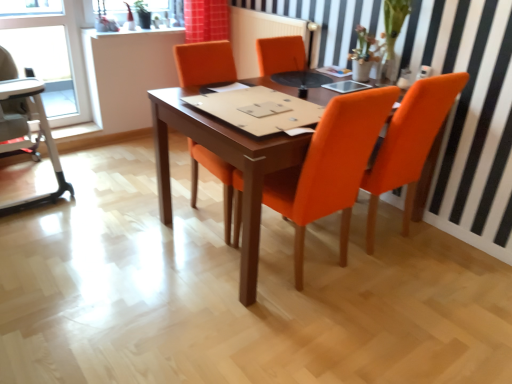
Find the location of a particular element. wooden table at center is located at coordinates (228, 161).

What do you see at coordinates (237, 219) in the screenshot?
I see `orange fabric chair at right, which is the 2th chair in left-to-right order` at bounding box center [237, 219].

At what (x,y) coordinates should I click in order to perform the action: click on beige fabric high chair at left. Please return your answer as a coordinate pair (x, y). The height and width of the screenshot is (384, 512). Looking at the image, I should click on (25, 126).

This screenshot has height=384, width=512. Identify the location of wooden table at center. (228, 161).

From the image's perspective, is orange fabric chair at right, the 1th chair from the right, over orange fabric chair at center, the second chair from the right?

Incorrect, from the image's perspective, orange fabric chair at right, the 1th chair from the right, is lower than orange fabric chair at center, the second chair from the right.

Which point is more forward, (439, 96) or (209, 44)?

The point (439, 96) is closer to the camera.

Considering the relative sizes of orange fabric chair at right, which is the 2th chair in left-to-right order, and orange fabric chair at center, the second chair from the right, in the image provided, is orange fabric chair at right, which is the 2th chair in left-to-right order, bigger than orange fabric chair at center, the second chair from the right,?

No, orange fabric chair at right, which is the 2th chair in left-to-right order, is not bigger than orange fabric chair at center, the second chair from the right.

From the image's perspective, is beige fabric high chair at left located above or below orange fabric chair at center, the second chair from the right?

beige fabric high chair at left is above orange fabric chair at center, the second chair from the right.

In terms of size, does beige fabric high chair at left appear bigger or smaller than orange fabric chair at center, the second chair from the right?

Considering their sizes, beige fabric high chair at left takes up more space than orange fabric chair at center, the second chair from the right.

From a real-world perspective, is beige fabric high chair at left located beneath orange fabric chair at center, positioned as the first chair in left-to-right order?

Indeed, from a real-world perspective, beige fabric high chair at left is positioned beneath orange fabric chair at center, positioned as the first chair in left-to-right order.

Does point (16, 88) appear closer or farther from the camera than point (226, 73)?

Point (16, 88) appears to be closer to the viewer than point (226, 73).

Between transparent glass window at upper left and wooden table at center, which one has smaller size?

With smaller size is transparent glass window at upper left.

Is transparent glass window at upper left looking in the opposite direction of wooden table at center?

No.

Can you see transparent glass window at upper left touching wooden table at center?

They are not placed beside each other.

Based on the photo, would you consider beige fabric high chair at left to be distant from wooden table at center?

beige fabric high chair at left is positioned a significant distance from wooden table at center.

From the image's perspective, who appears lower, beige fabric high chair at left or wooden table at center?

wooden table at center appears lower in the image.

From a real-world perspective, which object rests below the other?

In real-world perspective, wooden table at center is lower.

From a real-world perspective, which is physically below, orange fabric chair at center, the second chair from the right, or orange fabric chair at right, which is the 2th chair in left-to-right order?

In real-world perspective, orange fabric chair at right, which is the 2th chair in left-to-right order, is lower.

From the picture: Which is more to the right, orange fabric chair at center, the second chair from the right, or orange fabric chair at right, the 1th chair from the right?

orange fabric chair at right, the 1th chair from the right.

In the scene shown: Is the surface of orange fabric chair at center, the second chair from the right, in direct contact with orange fabric chair at right, the 1th chair from the right?

No, orange fabric chair at center, the second chair from the right, is not making contact with orange fabric chair at right, the 1th chair from the right.

Is orange fabric chair at center, the second chair from the right, taller than transparent glass window at upper left?

Yes.

Is orange fabric chair at center, the second chair from the right, facing towards transparent glass window at upper left?

No, orange fabric chair at center, the second chair from the right, does not turn towards transparent glass window at upper left.

Considering the relative sizes of orange fabric chair at center, the second chair from the right, and transparent glass window at upper left in the image provided, is orange fabric chair at center, the second chair from the right, bigger than transparent glass window at upper left?

Yes, orange fabric chair at center, the second chair from the right, is bigger than transparent glass window at upper left.

Which object is wider, orange fabric chair at center, positioned as the first chair in left-to-right order, or transparent glass window at upper left?

With larger width is orange fabric chair at center, positioned as the first chair in left-to-right order.

From a real-world perspective, is wooden table at center physically located above or below beige fabric high chair at left?

From a real-world perspective, wooden table at center is physically below beige fabric high chair at left.

What's the angular difference between wooden table at center and beige fabric high chair at left's facing directions?

The angle between the facing direction of wooden table at center and the facing direction of beige fabric high chair at left is 90.6 degrees.

From the image's perspective, is wooden table at center located above or below beige fabric high chair at left?

Clearly, from the image's perspective, wooden table at center is below beige fabric high chair at left.

Considering the positions of point (188, 116) and point (7, 140), is point (188, 116) closer or farther from the camera than point (7, 140)?

Clearly, point (188, 116) is closer to the camera than point (7, 140).

The height and width of the screenshot is (384, 512). What are the coordinates of `chair behind the orange fabric chair at right, the 1th chair from the right` in the screenshot? It's located at (206, 65).

The width and height of the screenshot is (512, 384). I want to click on armchair above the orange fabric chair at center, the second chair from the right (from the image's perspective), so (25, 126).

When comparing their distances from beige fabric high chair at left, does transparent glass window at upper left or wooden table at center seem closer?

transparent glass window at upper left is positioned closer to the anchor beige fabric high chair at left.

Which object lies further to the anchor point transparent glass window at upper left, beige fabric high chair at left or wooden table at center?

The object further to transparent glass window at upper left is wooden table at center.

From the picture: Estimate the real-world distances between objects in this image. Which object is closer to wooden table at center, beige fabric high chair at left or orange fabric chair at center, the second chair from the right?

orange fabric chair at center, the second chair from the right, is closer to wooden table at center.

Which object lies nearer to the anchor point wooden table at center, beige fabric high chair at left or transparent glass window at upper left?

Among the two, beige fabric high chair at left is located nearer to wooden table at center.

Consider the image. Considering their positions, is orange fabric chair at center, the second chair from the right, positioned further to beige fabric high chair at left than wooden table at center?

The object further to beige fabric high chair at left is orange fabric chair at center, the second chair from the right.

Considering their positions, is orange fabric chair at center, positioned as the first chair in left-to-right order, positioned further to wooden table at center than transparent glass window at upper left?

transparent glass window at upper left lies further to wooden table at center than the other object.

Looking at the image, which one is located further to transparent glass window at upper left, orange fabric chair at right, which is the 2th chair in left-to-right order, or beige fabric high chair at left?

orange fabric chair at right, which is the 2th chair in left-to-right order, is positioned further to the anchor transparent glass window at upper left.

Looking at this image, considering their positions, is transparent glass window at upper left positioned closer to orange fabric chair at right, which is the 2th chair in left-to-right order, than beige fabric high chair at left?

Based on the image, beige fabric high chair at left appears to be nearer to orange fabric chair at right, which is the 2th chair in left-to-right order.

At what (x,y) coordinates should I click in order to perform the action: click on chair between beige fabric high chair at left and wooden table at center from left to right. Please return your answer as a coordinate pair (x, y). Looking at the image, I should click on [x=206, y=65].

This screenshot has height=384, width=512. I want to click on chair situated between beige fabric high chair at left and orange fabric chair at right, which is the 2th chair in left-to-right order, from left to right, so click(x=206, y=65).

Where is `armchair between transparent glass window at upper left and orange fabric chair at center, the second chair from the right, in the horizontal direction`? armchair between transparent glass window at upper left and orange fabric chair at center, the second chair from the right, in the horizontal direction is located at coordinates (25, 126).

Image resolution: width=512 pixels, height=384 pixels. I want to click on armchair situated between transparent glass window at upper left and wooden table at center from left to right, so (25, 126).